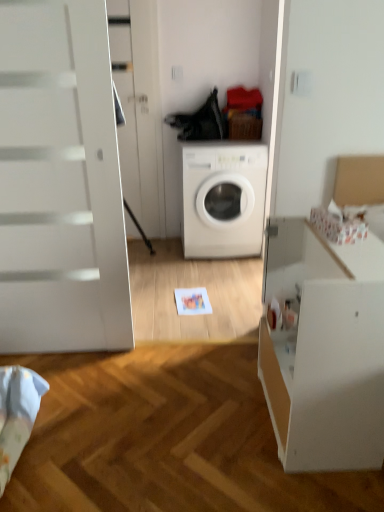
What do you see at coordinates (60, 182) in the screenshot? I see `white glossy screen door at upper left` at bounding box center [60, 182].

At what (x,y) coordinates should I click in order to perform the action: click on white matte washing machine at center. Please return your answer as a coordinate pair (x, y). The width and height of the screenshot is (384, 512). Looking at the image, I should click on (223, 198).

Where is `white matte file cabinet at right`? This screenshot has height=512, width=384. white matte file cabinet at right is located at coordinates (324, 349).

Which of these two, white matte file cabinet at right or white matte washing machine at center, is smaller?

With smaller size is white matte file cabinet at right.

This screenshot has height=512, width=384. Identify the location of washing machine located on the left of white matte file cabinet at right. (223, 198).

Could white matte washing machine at center be considered to be inside white matte file cabinet at right?

Actually, white matte washing machine at center is outside white matte file cabinet at right.

Is white matte file cabinet at right wider than white matte washing machine at center?

In fact, white matte file cabinet at right might be narrower than white matte washing machine at center.

Is point (42, 279) closer or farther from the camera than point (187, 257)?

Point (42, 279) appears to be closer to the viewer than point (187, 257).

The image size is (384, 512). In order to click on screen door to the left of white matte washing machine at center in this screenshot , I will do `click(60, 182)`.

Is white glossy screen door at upper left in front of white matte washing machine at center?

Yes, the depth of white glossy screen door at upper left is less than that of white matte washing machine at center.

Which object is positioned more to the right, white glossy screen door at upper left or white matte file cabinet at right?

white matte file cabinet at right is more to the right.

Is white glossy screen door at upper left positioned far away from white matte file cabinet at right?

Yes.

Does white glossy screen door at upper left have a smaller size compared to white matte file cabinet at right?

Yes.

Between point (28, 181) and point (346, 285), which one is positioned behind?

The point (28, 181) is behind.

Could you tell me if white matte file cabinet at right is facing white glossy screen door at upper left?

No, white matte file cabinet at right is not facing towards white glossy screen door at upper left.

Which object is closer to the camera, white matte file cabinet at right or white glossy screen door at upper left?

white matte file cabinet at right is in front.

Is white matte file cabinet at right to the left or to the right of white glossy screen door at upper left in the image?

Based on their positions, white matte file cabinet at right is located to the right of white glossy screen door at upper left.

From the image's perspective, would you say white matte file cabinet at right is positioned over white glossy screen door at upper left?

Actually, white matte file cabinet at right appears below white glossy screen door at upper left in the image.

Identify the location of washing machine that is behind the white glossy screen door at upper left. This screenshot has height=512, width=384. (223, 198).

Is point (260, 192) positioned before point (104, 10)?

No, it is not.

Between white matte washing machine at center and white glossy screen door at upper left, which one has less height?

white matte washing machine at center.

From the image's perspective, is white matte washing machine at center located beneath white glossy screen door at upper left?

Yes, from the image's perspective, white matte washing machine at center is beneath white glossy screen door at upper left.

Is white matte washing machine at center inside the boundaries of white matte file cabinet at right, or outside?

white matte washing machine at center exists outside the volume of white matte file cabinet at right.

Is point (205, 168) farther from viewer compared to point (288, 375)?

Yes, it is behind point (288, 375).

This screenshot has width=384, height=512. In order to click on file cabinet below the white matte washing machine at center (from a real-world perspective) in this screenshot , I will do `click(324, 349)`.

Which object is positioned more to the left, white matte washing machine at center or white matte file cabinet at right?

white matte washing machine at center is more to the left.

Image resolution: width=384 pixels, height=512 pixels. I want to click on file cabinet below the white matte washing machine at center (from the image's perspective), so click(324, 349).

This screenshot has width=384, height=512. Identify the location of screen door lying on the left of white matte washing machine at center. (60, 182).

Looking at this image, based on their spatial positions, is white matte washing machine at center or white matte file cabinet at right closer to white glossy screen door at upper left?

white matte file cabinet at right lies closer to white glossy screen door at upper left than the other object.

From the image, which object appears to be nearer to white glossy screen door at upper left, white matte file cabinet at right or white matte washing machine at center?

white matte file cabinet at right is positioned closer to the anchor white glossy screen door at upper left.

From the image, which object appears to be nearer to white matte washing machine at center, white glossy screen door at upper left or white matte file cabinet at right?

white glossy screen door at upper left is positioned closer to the anchor white matte washing machine at center.

Estimate the real-world distances between objects in this image. Which object is further from white matte file cabinet at right, white glossy screen door at upper left or white matte washing machine at center?

white matte washing machine at center lies further to white matte file cabinet at right than the other object.

When comparing their distances from white matte washing machine at center, does white matte file cabinet at right or white glossy screen door at upper left seem closer?

Based on the image, white glossy screen door at upper left appears to be nearer to white matte washing machine at center.

Based on their spatial positions, is white matte washing machine at center or white glossy screen door at upper left further from white matte file cabinet at right?

The object further to white matte file cabinet at right is white matte washing machine at center.

Locate an element on the screen. The height and width of the screenshot is (512, 384). screen door between white matte file cabinet at right and white matte washing machine at center along the z-axis is located at coordinates (60, 182).